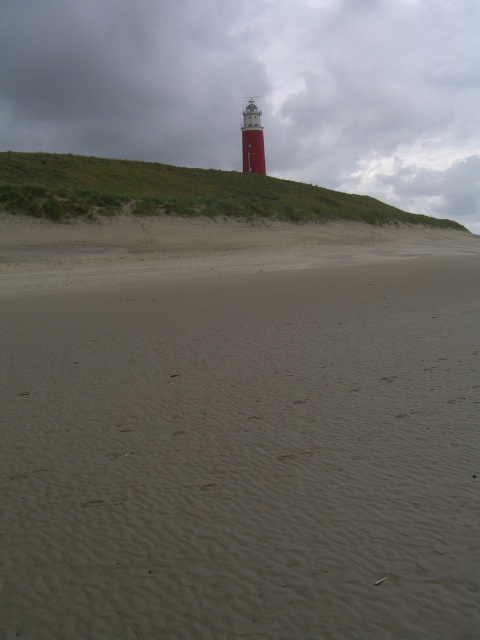
You are planning to build a small sandcastle on the smooth beige sand at center. Considering the width of the sand area, will you have enough space to construct it without it being too close to the green grassy hillside at upper center?

The smooth beige sand at center is narrower than the green grassy hillside at upper center, so there is limited space for the sandcastle. You should ensure the sandcastle is placed within the available sandy area to avoid proximity to the hillside.

You are standing on the beach and see two points marked in the scene. Which point, point (x=365, y=570) or point (x=252, y=113), is closer to you?

Point (x=365, y=570) is closer to the viewer than point (x=252, y=113).

You are a photographer planning to capture the smooth red lighthouse at center and the green grassy hillside at upper center in a single frame. Given their sizes, which object will occupy more of the photo composition?

The green grassy hillside at upper center will occupy more of the photo composition because it has a larger size compared to the smooth red lighthouse at center.